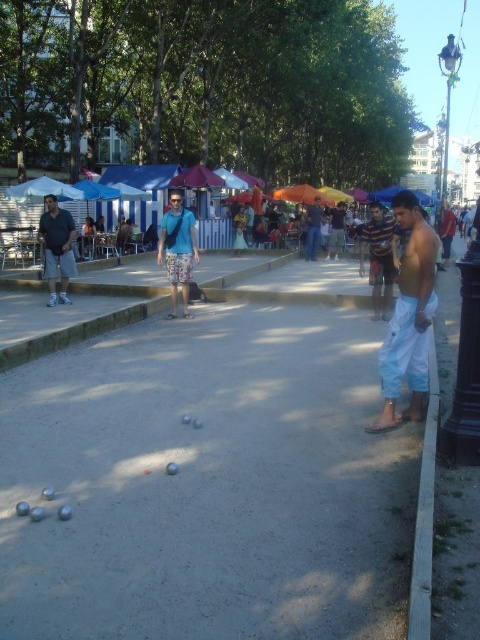
You are a petyanque player standing at the edge of the court. You see the blue denim shorts at center and the shiny silver ball at center. Which object is closer to your right side?

The shiny silver ball at center is closer to your right side because the blue denim shorts at center is to the left of it.

You are a petaque player standing at the center of the court. You need to retrieve the matte gray shorts at left and the white fabric umbrella at upper left. Which object is closer to your current position?

The matte gray shorts at left is 19.85 feet away from the white fabric umbrella at upper left. Since you are at the center of the court, the distance to each object depends on their positions. However, the description only provides the distance between the two objects, not their individual distances from the center. Therefore, it is impossible to determine which is closer without additional information.

You are a peticanque player standing at the edge of the court. You see the blue denim shorts at center and the shiny silver ball at center. Which object is closer to you?

The shiny silver ball at center is closer to you because the blue denim shorts at center is 24.89 feet away from it, implying the ball is nearer to your position at the edge.